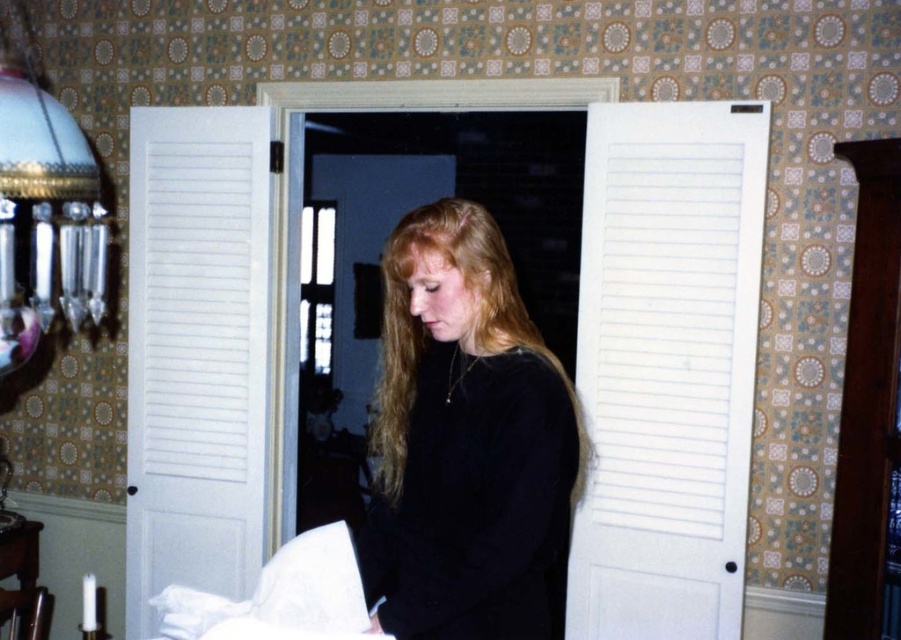
You are organizing a clothing donation drive and need to determine if the black velvet sweater at center can fit into a box that is as wide as the matte glass lampshade at left. Can the sweater fit?

The black velvet sweater at center is thinner than the matte glass lampshade at left, so it can fit into a box as wide as the lampshade.